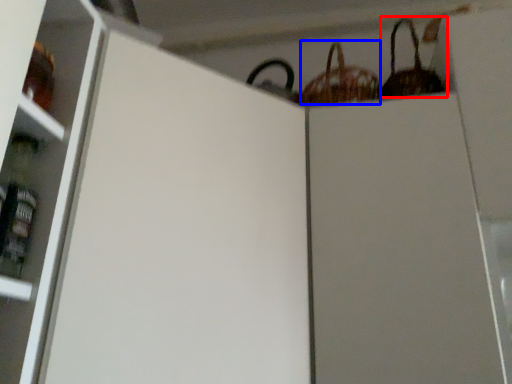
Question: Which object is further to the camera taking this photo, basket (highlighted by a red box) or basket (highlighted by a blue box)?

Choices:
 (A) basket
 (B) basket

Answer: (B)